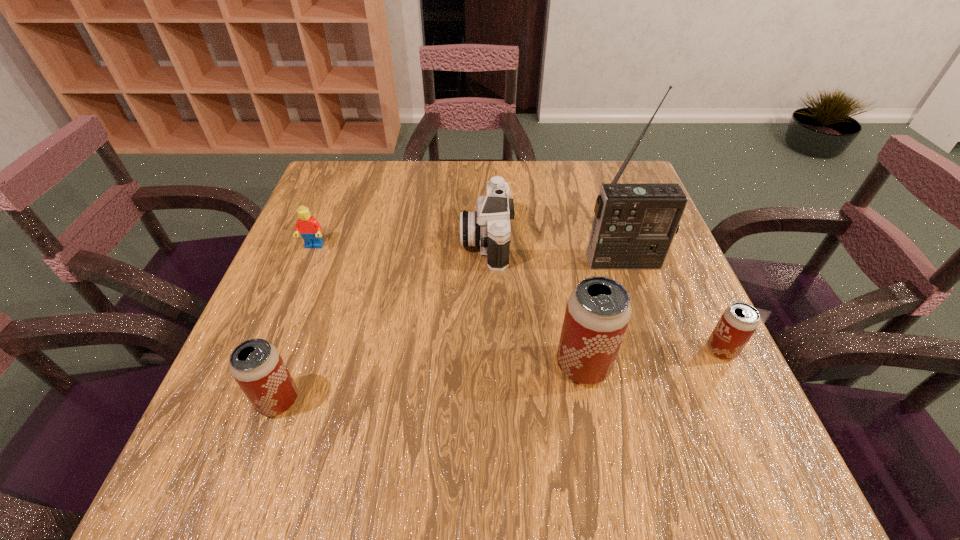
Locate an element on the screen. This screenshot has width=960, height=540. vacant spot for a new beer_can to ensure equal spacing is located at coordinates (436, 383).